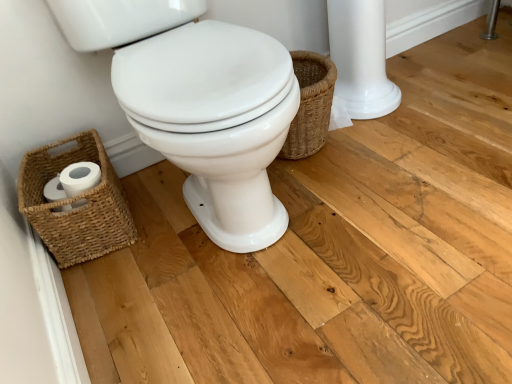
Question: Should I look upward or downward to see woven brown basket at lower left?

Choices:
 (A) down
 (B) up

Answer: (A)